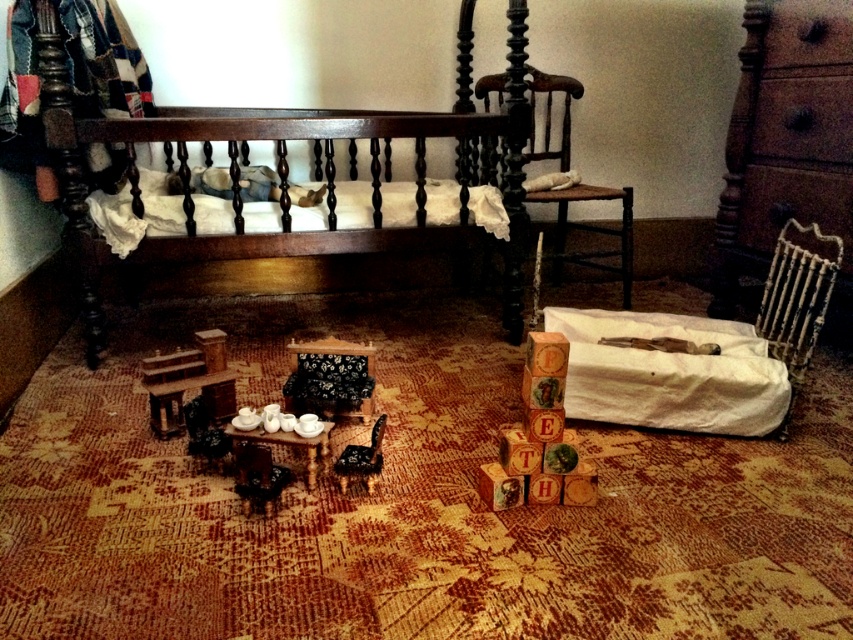
You are a tiny toy mouse that is 2 inches wide. You want to move from the wooden blocks at center to the black floral fabric chair at center. Is there enough space for you to move freely between them?

The distance between the wooden blocks at center and the black floral fabric chair at center is 19.17 inches. Since the mouse is only 2 inches wide, there is ample space for it to move freely between them.

You are a tiny explorer in this miniature room. You want to reach the dark wood bed at upper left, but you can only move in straight lines. There is an obstacle at point (279, 170). Is the obstacle blocking your path to the bed?

The obstacle at point (279, 170) is the dark wood bed at upper left itself, so it is not blocking your path but is your destination.

You are a miniature explorer standing at the entrance of this dollhouse room. You need to reach the dark wood bed at upper left. Considering your height is 1.6 meters, will you be able to see over the small wooden table set with miniature teacups and saucers in the foreground without any obstacles?

The dark wood bed at upper left is 1.76 meters away from you. Since the small wooden table set with miniature teacups and saucers is in the foreground, it might block your view. However, your height of 1.6 meters may allow you to see over the table if it is low enough. But without knowing the table height, it is uncertain.